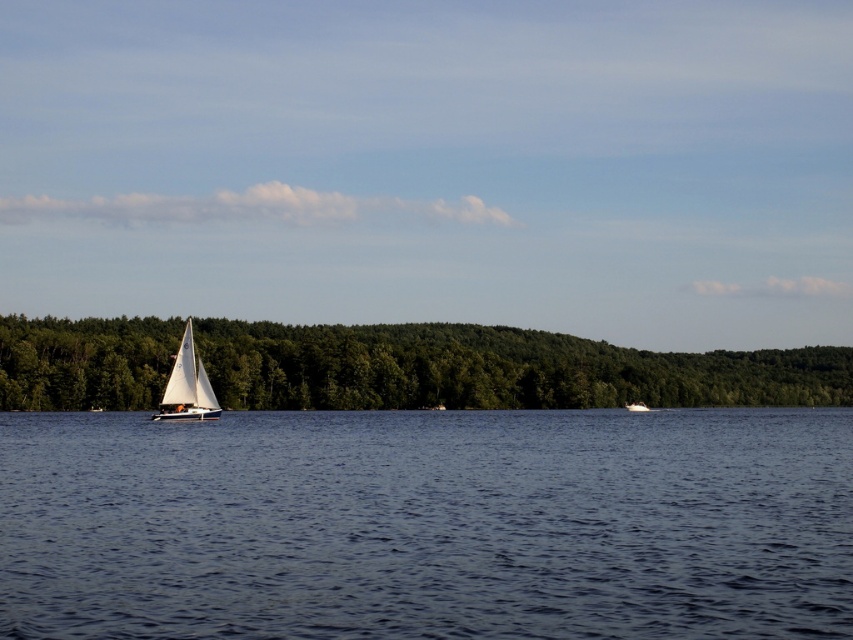
Question: Which point is closer to the camera?

Choices:
 (A) green leafy trees at left
 (B) white glossy boat at center
 (C) blue water at center
 (D) white sailboat at left

Answer: (C)

Question: Which object is the closest to the white sailboat at left?

Choices:
 (A) blue water at center
 (B) green leafy trees at left

Answer: (A)

Question: Can you confirm if blue water at center is smaller than white sailboat at left?

Choices:
 (A) no
 (B) yes

Answer: (A)

Question: Which point appears farthest from the camera in this image?

Choices:
 (A) (79, 392)
 (B) (187, 332)
 (C) (682, 614)

Answer: (A)

Question: Is green leafy trees at left thinner than white glossy boat at center?

Choices:
 (A) yes
 (B) no

Answer: (B)

Question: Does blue water at center have a greater width compared to green leafy trees at left?

Choices:
 (A) yes
 (B) no

Answer: (B)